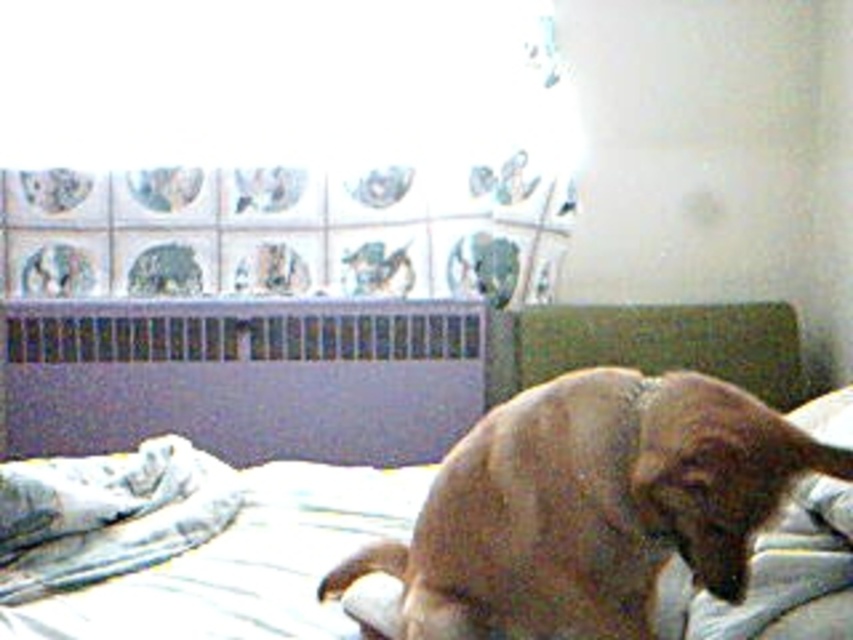
Question: Can you confirm if brown furry dog at center is smaller than white soft blanket at lower left?

Choices:
 (A) no
 (B) yes

Answer: (A)

Question: Which point appears closest to the camera in this image?

Choices:
 (A) (218, 520)
 (B) (532, 456)

Answer: (B)

Question: Where is brown furry dog at center located in relation to white soft blanket at lower left in the image?

Choices:
 (A) right
 (B) left

Answer: (A)

Question: Which point is closer to the camera?

Choices:
 (A) white soft blanket at lower left
 (B) brown furry dog at center

Answer: (B)

Question: Can you confirm if brown furry dog at center is bigger than white soft blanket at lower left?

Choices:
 (A) yes
 (B) no

Answer: (A)